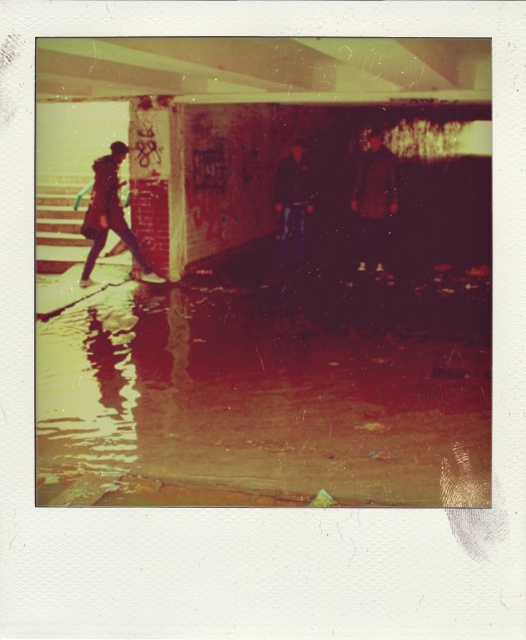
You are standing at the entrance of the dimly lit area and see the wet concrete pavement at lower center. Where exactly is the wet concrete pavement located in relation to your position?

The wet concrete pavement at lower center is located at point 0.620 on the horizontal axis and 0.506 on the vertical axis relative to your position.

You are standing in the room and see both the matte brown coat at center and the dark blue fabric jacket at center. Which one is nearer to you?

The matte brown coat at center is closer to the viewer than the dark blue fabric jacket at center.

You are standing in the scene and want to step onto the wet concrete pavement at lower center. Is the matte brown coat at center blocking your path?

The wet concrete pavement at lower center is closer to the viewer than the matte brown coat at center, so the matte brown coat at center is behind the pavement and not blocking the path.